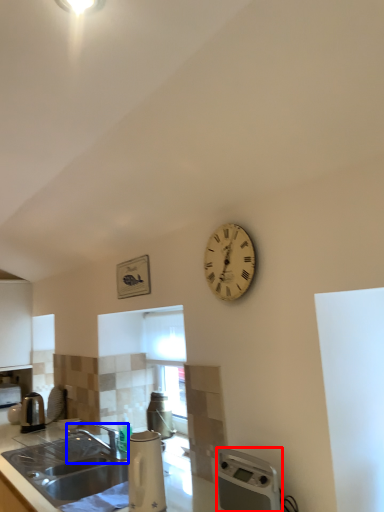
Question: Which point is closer to the camera, water heater (highlighted by a red box) or tap (highlighted by a blue box)?

Choices:
 (A) water heater
 (B) tap

Answer: (A)